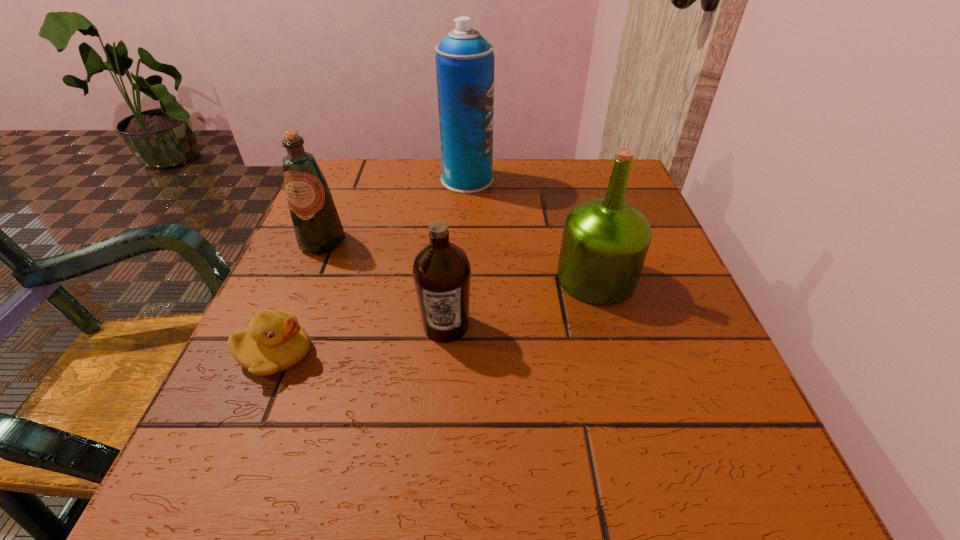
Locate an element on the screen. This screenshot has width=960, height=540. vacant position located 0.400m at the beak of the shortest object is located at coordinates (571, 354).

Identify the location of object present at the far edge. This screenshot has height=540, width=960. (464, 59).

What are the coordinates of `olive oil that is at the left edge` in the screenshot? It's located at (317, 225).

Identify the location of duckling that is at the left edge. (274, 342).

The width and height of the screenshot is (960, 540). I want to click on object located in the right edge section of the desktop, so click(605, 241).

You are a GUI agent. You are given a task and a screenshot of the screen. Output one action in this format:
    pyautogui.click(x=<x>, y=<y>)
    Task: Click on the vacant region at the far edge of the desktop
    This screenshot has width=960, height=540.
    Given the screenshot: What is the action you would take?
    pyautogui.click(x=565, y=189)

You are a GUI agent. You are given a task and a screenshot of the screen. Output one action in this format:
    pyautogui.click(x=<x>, y=<y>)
    Task: Click on the vacant space at the near edge
    
    Given the screenshot: What is the action you would take?
    pyautogui.click(x=485, y=493)

The height and width of the screenshot is (540, 960). In the image, there is a desktop. In order to click on vacant space at the left edge in this screenshot , I will do `click(281, 295)`.

This screenshot has width=960, height=540. I want to click on blank space at the right edge of the desktop, so click(x=659, y=235).

In the image, there is a desktop. Identify the location of vacant space at the far left corner. The height and width of the screenshot is (540, 960). (370, 185).